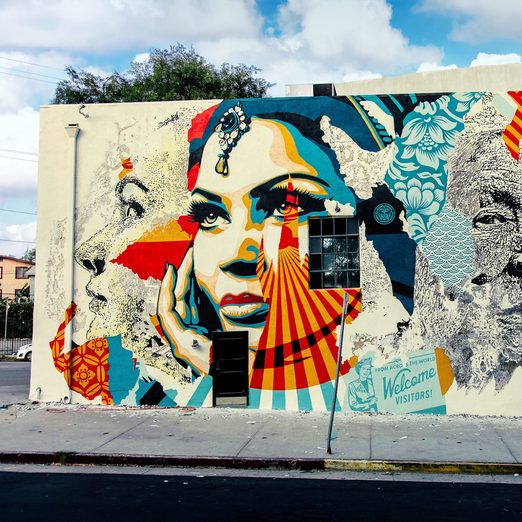
Locate an element on the screen. black door is located at coordinates (228, 364).